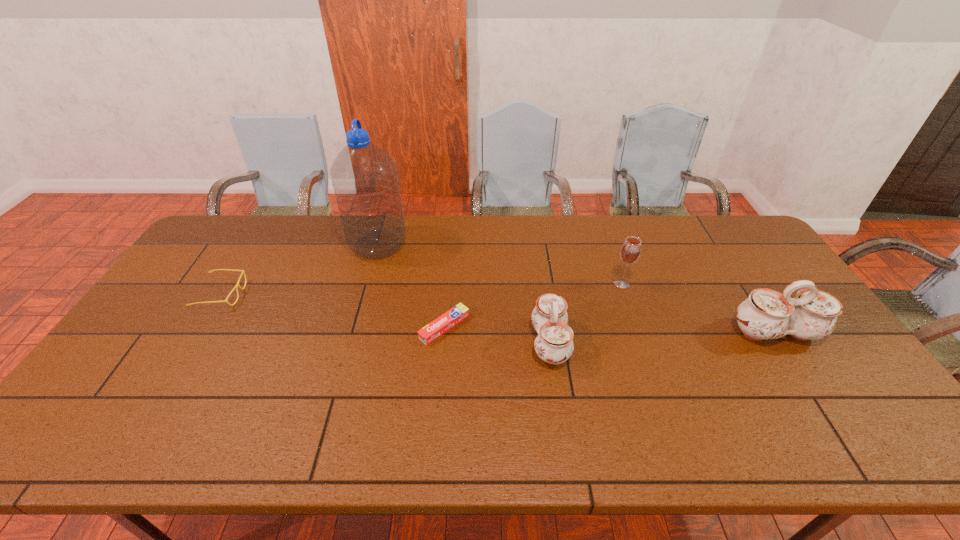
Locate an element on the screen. The width and height of the screenshot is (960, 540). the shorter chinaware is located at coordinates (554, 344).

I want to click on the fourth object from left to right, so click(554, 344).

Image resolution: width=960 pixels, height=540 pixels. What are the coordinates of `the right chinaware` in the screenshot? It's located at (767, 314).

Identify the location of the rightmost object. (767, 314).

The width and height of the screenshot is (960, 540). I want to click on the shortest object, so click(429, 333).

This screenshot has height=540, width=960. Identify the location of the fourth object from right to left. (429, 333).

Where is `the second shortest object`? the second shortest object is located at coordinates (237, 285).

At what (x,y) coordinates should I click in order to perform the action: click on spectacles. Please return your answer as a coordinate pair (x, y). Looking at the image, I should click on (237, 285).

Where is `the tallest object`? the tallest object is located at coordinates (365, 180).

At what (x,y) coordinates should I click in order to perform the action: click on the farthest object. Please return your answer as a coordinate pair (x, y). The height and width of the screenshot is (540, 960). Looking at the image, I should click on (365, 180).